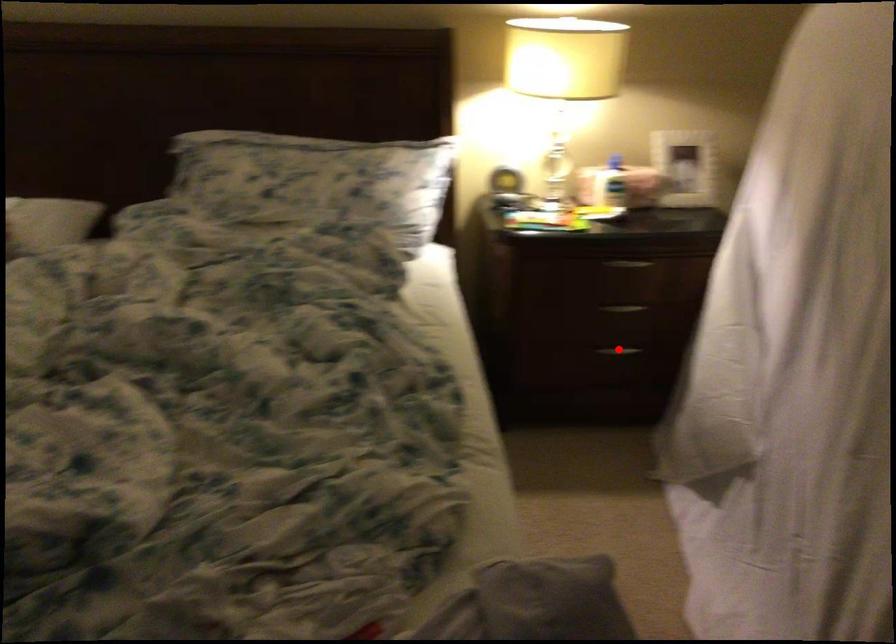
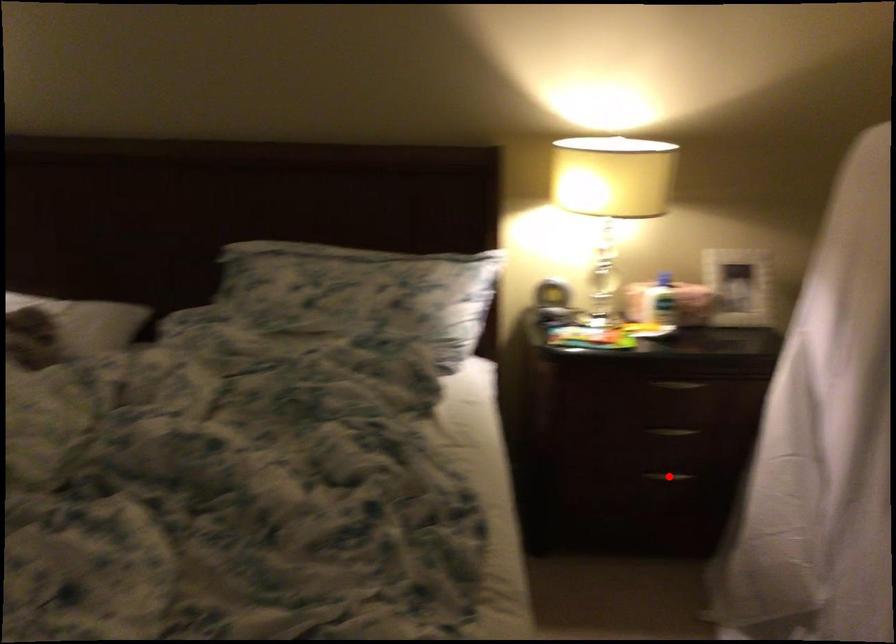
I am providing you with two images of the same scene from different viewpoints. A red point is marked on the first image and another point is marked on the second image. Are the points marked in image1 and image2 representing the same 3D position?

Yes